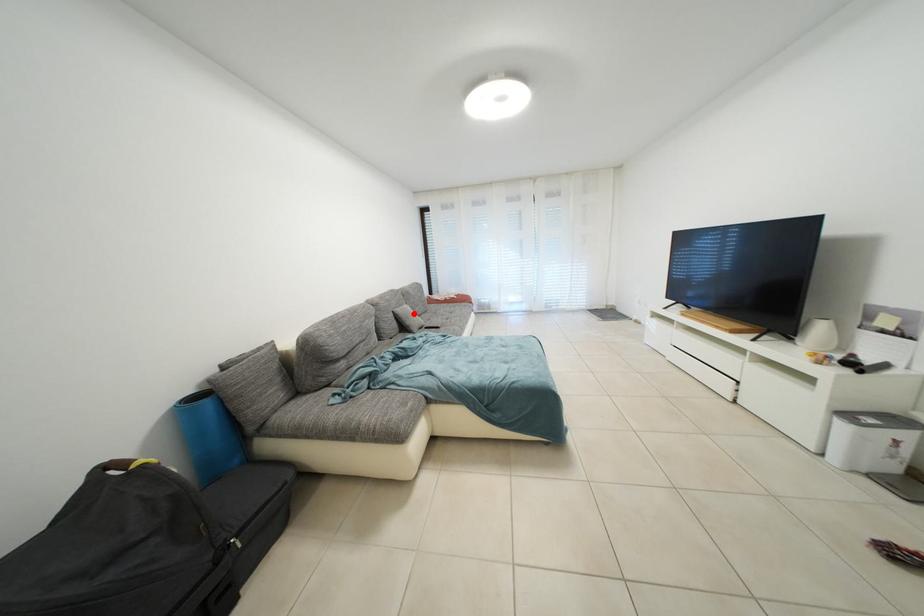
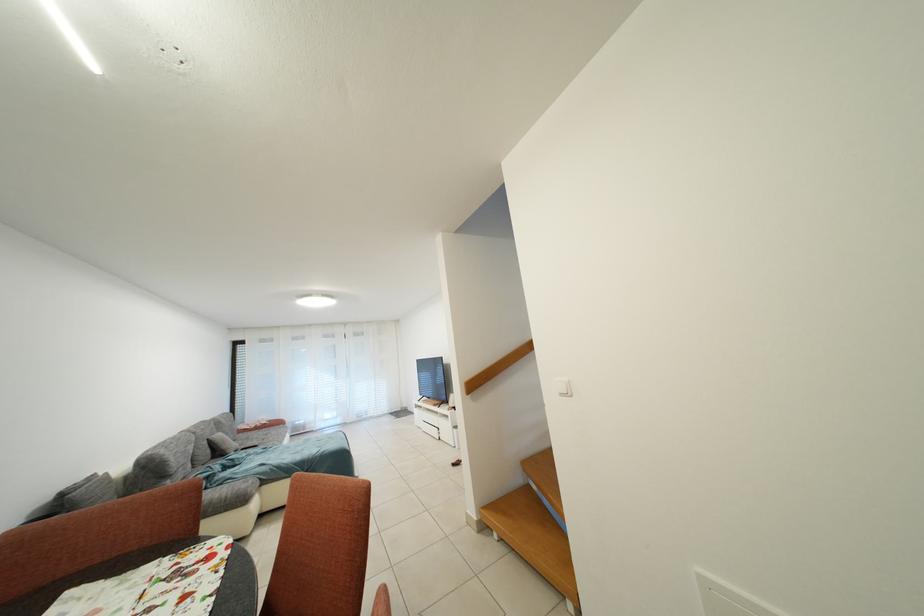
Question: I am providing you with two images of the same scene from different viewpoints. A red point is marked on the first image. Is the red point's position out of view in image 2?

Choices:
 (A) Yes
 (B) No

Answer: (B)